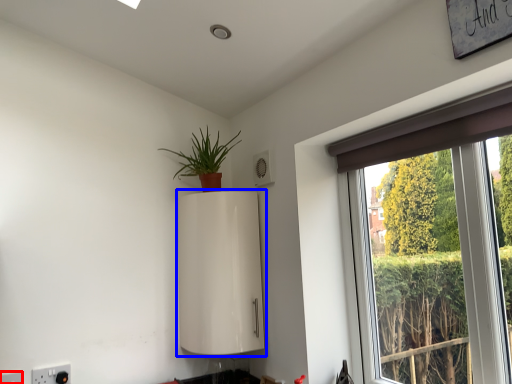
Question: Which object is closer to the camera taking this photo, electric outlet (highlighted by a red box) or appliance (highlighted by a blue box)?

Choices:
 (A) electric outlet
 (B) appliance

Answer: (A)